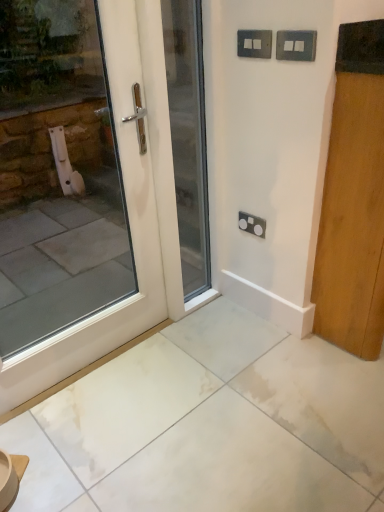
Question: Is point (203, 175) positioned closer to the camera than point (81, 354)?

Choices:
 (A) closer
 (B) farther

Answer: (B)

Question: Based on their positions, is white glossy door at center, which is the 2th door from right to left, located to the left or right of white glossy door at left, acting as the third door starting from the right?

Choices:
 (A) left
 (B) right

Answer: (B)

Question: Which is nearer to the satin black socket at center, which ranks as the third electric outlet in front-to-back order?

Choices:
 (A) wooden door at right, the 3th door viewed from the left
 (B) metallic silver switch at upper center, which ranks as the 3th electric outlet in bottom-to-top order
 (C) white glossy door at left, acting as the third door starting from the right
 (D) metallic gray switch at upper right, which is counted as the second electric outlet, starting from the bottom
 (E) white glossy door at center, which is the 2th door from right to left

Answer: (A)

Question: Estimate the real-world distances between objects in this image. Which object is farther from the satin black socket at center, arranged as the first electric outlet when ordered from the bottom?

Choices:
 (A) white glossy door at left, which is counted as the first door, starting from the left
 (B) wooden door at right, positioned as the 1th door in right-to-left order
 (C) white glossy door at center, acting as the second door starting from the left
 (D) metallic gray switch at upper right, the 3th electric outlet from the back
 (E) metallic silver switch at upper center, which is counted as the first electric outlet, starting from the top

Answer: (D)